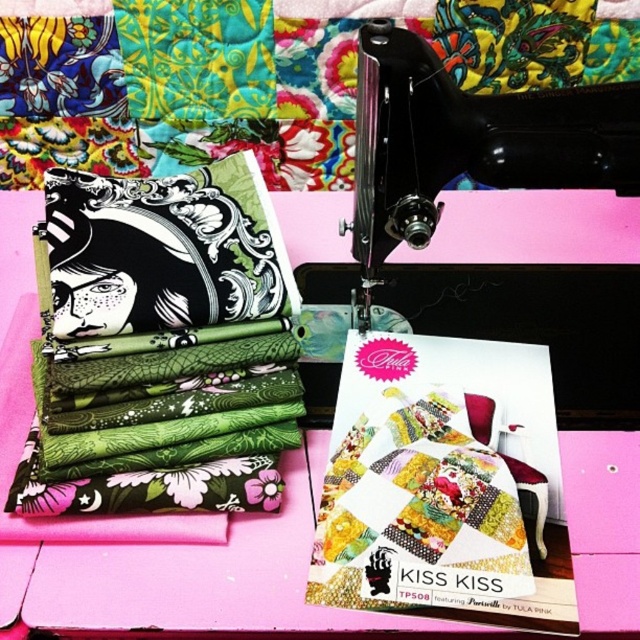
Based on the photo, you are a tailor who wants to place a new fabric roll on the pink wood table at center. However, there is already a stack of folded fabrics on the black plastic sewing machine at center. Can the fabric roll fit on the table instead?

The pink wood table at center is in front of the black plastic sewing machine at center, so the fabric roll can be placed on the table since it is accessible and not obstructed by the sewing machine.

You are a tailor who needs to place a small pin exactly halfway between point (188, 564) and point (356, 230). Where would you place the pin?

The halfway point between point (188, 564) and point (356, 230) is calculated by averaging their coordinates. The x coordinate is 0.623 and the y coordinate is 0.4265. So, place the pin at point 0.623, 0.4265.

You have a rectangular box that is 20 cm wide. You need to place it on either the pink wood table at center or the black plastic sewing machine at center. Which surface can it fit on without overhanging?

The pink wood table at center has a larger width than the black plastic sewing machine at center, so the box can fit on the pink wood table at center without overhanging.